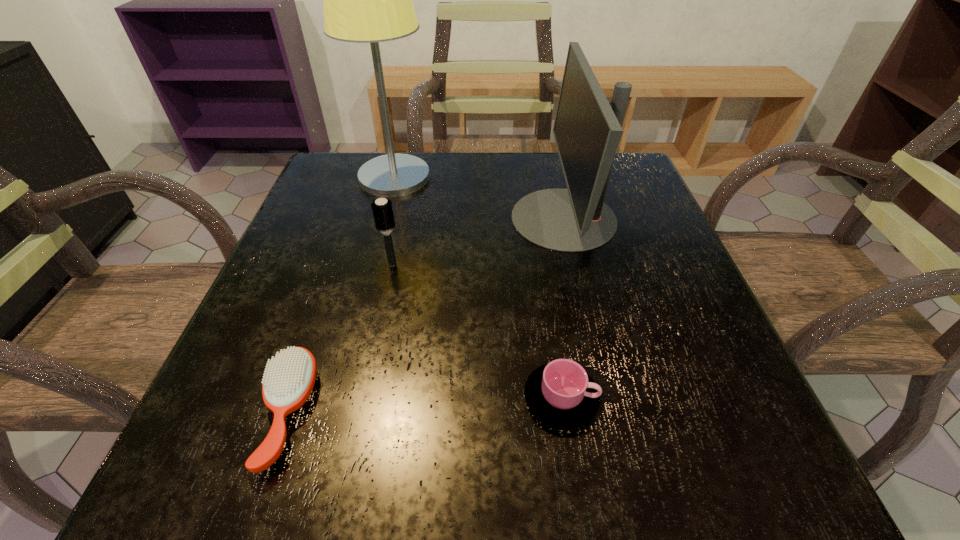
In order to click on table lamp in this screenshot , I will do `click(366, 0)`.

Locate an element on the screen. The width and height of the screenshot is (960, 540). computer monitor is located at coordinates (587, 130).

This screenshot has width=960, height=540. Identify the location of the third tallest object. (382, 209).

At what (x,y) coordinates should I click in order to perform the action: click on the right hairbrush. Please return your answer as a coordinate pair (x, y). Image resolution: width=960 pixels, height=540 pixels. Looking at the image, I should click on (382, 209).

Identify the location of cup. This screenshot has width=960, height=540. (561, 394).

What are the coordinates of `the shorter hairbrush` in the screenshot? It's located at (289, 378).

Identify the location of the left hairbrush. Image resolution: width=960 pixels, height=540 pixels. (289, 378).

Identify the location of vacant region located 0.250m on the front of the table lamp. (368, 276).

Where is `vacant space located 0.150m on the screen of the computer monitor`? vacant space located 0.150m on the screen of the computer monitor is located at coordinates (439, 218).

Locate an element on the screen. vacant space located on the screen of the computer monitor is located at coordinates (367, 218).